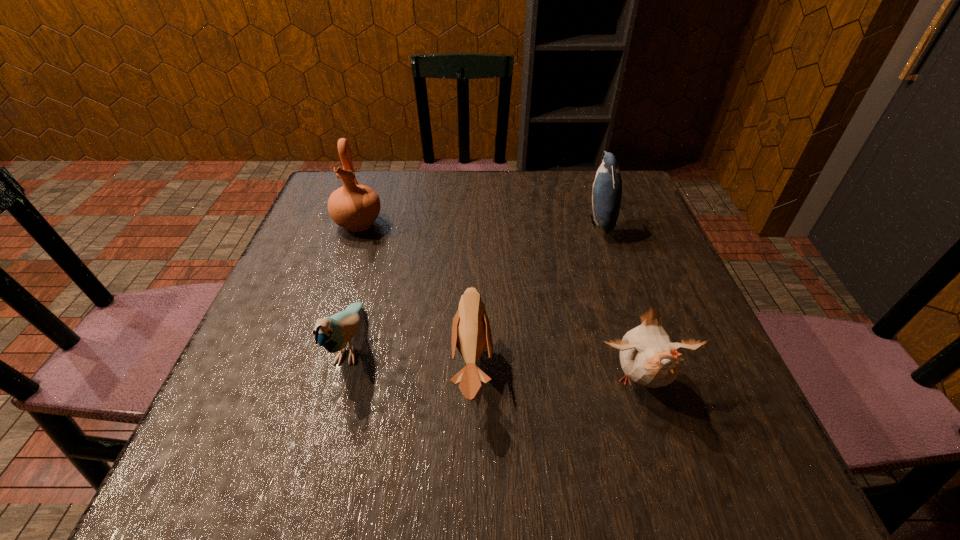
Image resolution: width=960 pixels, height=540 pixels. In order to click on free point located at the beak of the third bird from right to left in this screenshot , I will do `click(539, 367)`.

I want to click on pottery located in the far edge section of the desktop, so click(x=355, y=207).

I want to click on bird present at the far edge, so click(x=607, y=188).

Find the location of a particular element. This screenshot has height=540, width=960. pottery situated at the left edge is located at coordinates (355, 207).

Find the location of a particular element. This screenshot has width=960, height=540. bird at the left edge is located at coordinates (333, 333).

Identify the location of object located in the far left corner section of the desktop. (355, 207).

What are the coordinates of `object situated at the far right corner` in the screenshot? It's located at (607, 188).

Find the location of a particular element. The image size is (960, 540). vacant space at the far edge of the desktop is located at coordinates (473, 173).

This screenshot has height=540, width=960. I want to click on vacant space at the near edge, so click(629, 463).

Image resolution: width=960 pixels, height=540 pixels. I want to click on vacant space at the left edge of the desktop, so click(236, 422).